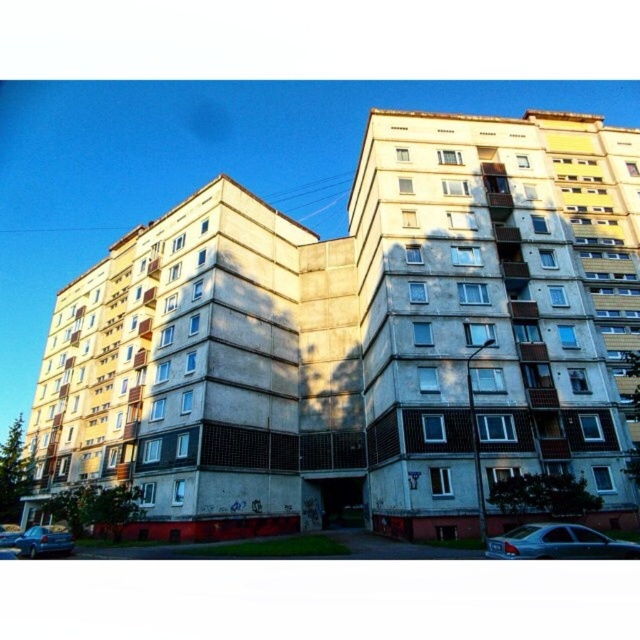
Question: Which object appears closest to the camera in this image?

Choices:
 (A) silver metallic sedan at lower left
 (B) metallic silver sedan at lower right

Answer: (B)

Question: Can you confirm if metallic silver sedan at lower right is positioned to the right of silver metallic sedan at lower left?

Choices:
 (A) no
 (B) yes

Answer: (B)

Question: Among these points, which one is nearest to the camera?

Choices:
 (A) (51, 536)
 (B) (588, 536)

Answer: (B)

Question: Can you confirm if metallic silver sedan at lower right is positioned below silver metallic sedan at lower left?

Choices:
 (A) yes
 (B) no

Answer: (B)

Question: Does metallic silver sedan at lower right appear over silver metallic sedan at lower left?

Choices:
 (A) yes
 (B) no

Answer: (A)